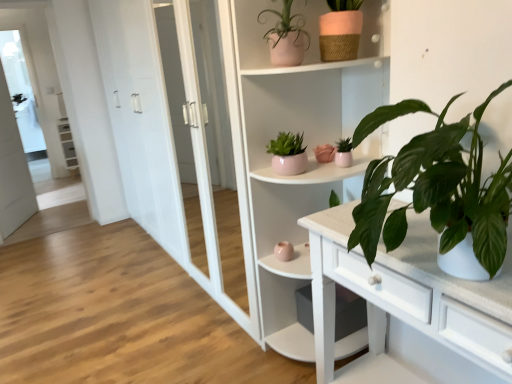
The width and height of the screenshot is (512, 384). In order to click on free region on the left part of white matte bookshelf at center in this screenshot , I will do `click(231, 355)`.